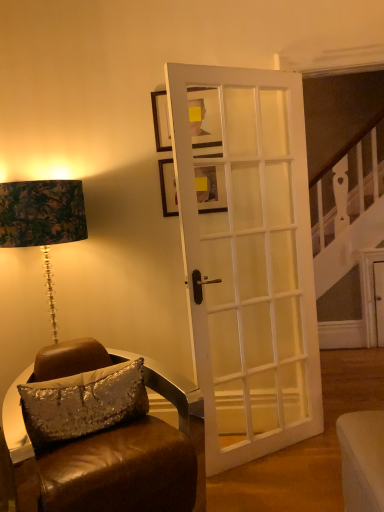
Question: Is white glossy door at center located within matte black picture frame at upper center, placed as the second picture frame when sorted from bottom to top?

Choices:
 (A) no
 (B) yes

Answer: (A)

Question: Considering the relative sizes of matte black picture frame at upper center, marked as the first picture frame in a top-to-bottom arrangement, and white glossy door at center in the image provided, is matte black picture frame at upper center, marked as the first picture frame in a top-to-bottom arrangement, thinner than white glossy door at center?

Choices:
 (A) yes
 (B) no

Answer: (A)

Question: Does matte black picture frame at upper center, marked as the first picture frame in a top-to-bottom arrangement, turn towards white glossy door at center?

Choices:
 (A) no
 (B) yes

Answer: (B)

Question: Can you confirm if matte black picture frame at upper center, marked as the first picture frame in a top-to-bottom arrangement, is bigger than white glossy door at center?

Choices:
 (A) yes
 (B) no

Answer: (B)

Question: Is matte black picture frame at upper center, placed as the second picture frame when sorted from bottom to top, at the left side of white glossy door at center?

Choices:
 (A) yes
 (B) no

Answer: (A)

Question: Is matte black picture frame at upper center, marked as the first picture frame in a top-to-bottom arrangement, positioned beyond the bounds of white glossy door at center?

Choices:
 (A) no
 (B) yes

Answer: (B)

Question: Is brown leather chair at lower left to the left of matte black picture frame at upper center, marked as the first picture frame in a top-to-bottom arrangement, from the viewer's perspective?

Choices:
 (A) no
 (B) yes

Answer: (B)

Question: Is brown leather chair at lower left facing towards matte black picture frame at upper center, placed as the second picture frame when sorted from bottom to top?

Choices:
 (A) no
 (B) yes

Answer: (A)

Question: From the image's perspective, does brown leather chair at lower left appear higher than matte black picture frame at upper center, placed as the second picture frame when sorted from bottom to top?

Choices:
 (A) no
 (B) yes

Answer: (A)

Question: Can you confirm if brown leather chair at lower left is shorter than matte black picture frame at upper center, placed as the second picture frame when sorted from bottom to top?

Choices:
 (A) no
 (B) yes

Answer: (A)

Question: Is brown leather chair at lower left turned away from matte black picture frame at upper center, placed as the second picture frame when sorted from bottom to top?

Choices:
 (A) yes
 (B) no

Answer: (B)

Question: Can you confirm if brown leather chair at lower left is thinner than matte black picture frame at upper center, marked as the first picture frame in a top-to-bottom arrangement?

Choices:
 (A) yes
 (B) no

Answer: (B)

Question: Can you confirm if matte black picture frame at upper center, marked as the first picture frame in a top-to-bottom arrangement, is thinner than brown leather chair at lower left?

Choices:
 (A) no
 (B) yes

Answer: (B)